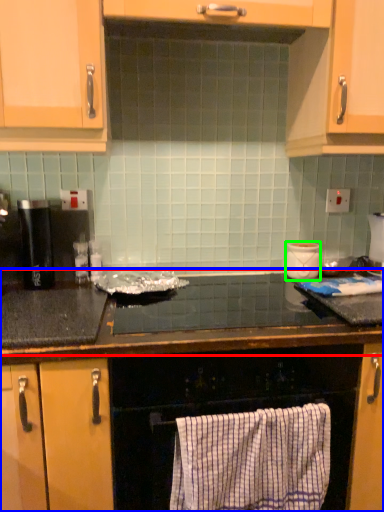
Question: Which is farther away from countertop (highlighted by a red box)? countertop (highlighted by a blue box) or appliance (highlighted by a green box)?

Choices:
 (A) countertop
 (B) appliance

Answer: (B)